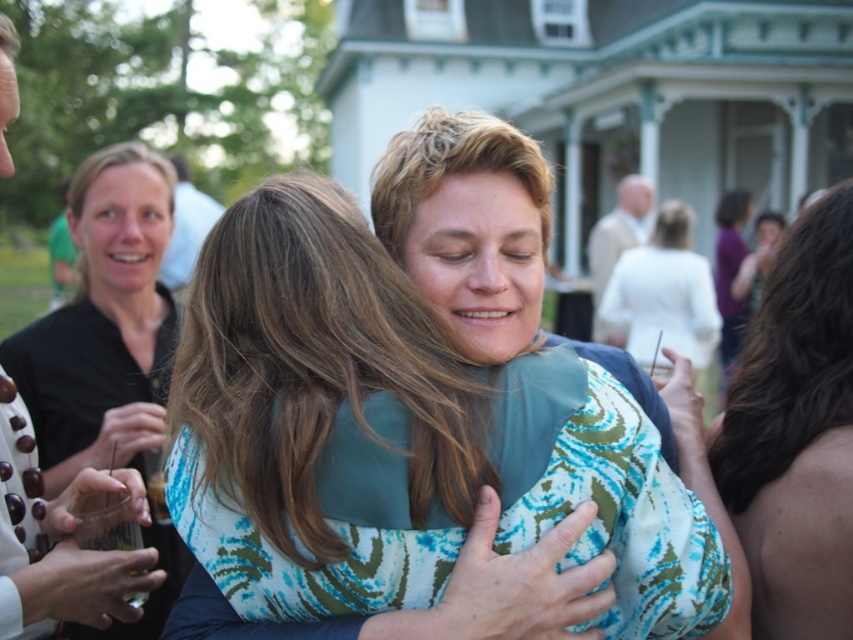
Consider the image. Can you confirm if black matte shirt at upper left is shorter than white satin dress at center?

No.

At what (x,y) coordinates should I click in order to perform the action: click on black matte shirt at upper left. Please return your answer as a coordinate pair (x, y). Image resolution: width=853 pixels, height=640 pixels. Looking at the image, I should click on (105, 321).

Does point (619, 188) lie in front of point (178, 232)?

No.

Can you confirm if light beige suit at upper right is positioned above matte white shirt at upper left?

Actually, light beige suit at upper right is below matte white shirt at upper left.

What do you see at coordinates (618, 243) in the screenshot? This screenshot has width=853, height=640. I see `light beige suit at upper right` at bounding box center [618, 243].

Find the location of a particular element. The height and width of the screenshot is (640, 853). light beige suit at upper right is located at coordinates (618, 243).

Who is higher up, black matte shirt at upper left or light beige suit at upper right?

black matte shirt at upper left is higher up.

Locate an element on the screen. The image size is (853, 640). black matte shirt at upper left is located at coordinates (105, 321).

Is point (129, 228) closer to viewer compared to point (607, 221)?

Yes.

This screenshot has width=853, height=640. I want to click on black matte shirt at upper left, so click(105, 321).